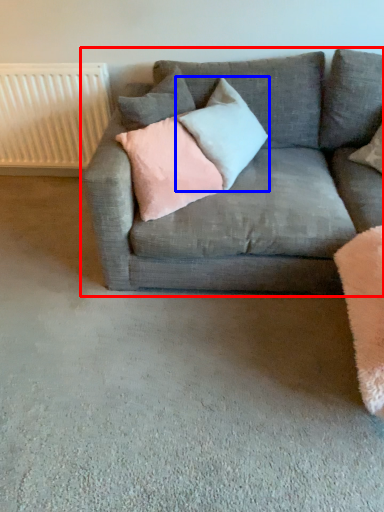
Question: Among these objects, which one is farthest to the camera, studio couch (highlighted by a red box) or pillow (highlighted by a blue box)?

Choices:
 (A) studio couch
 (B) pillow

Answer: (B)